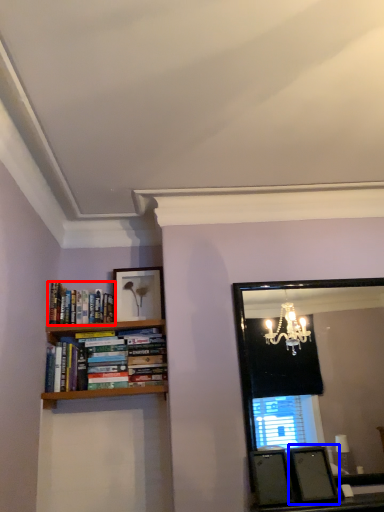
Question: Which point is further to the camera, book (highlighted by a red box) or picture frame (highlighted by a blue box)?

Choices:
 (A) book
 (B) picture frame

Answer: (A)